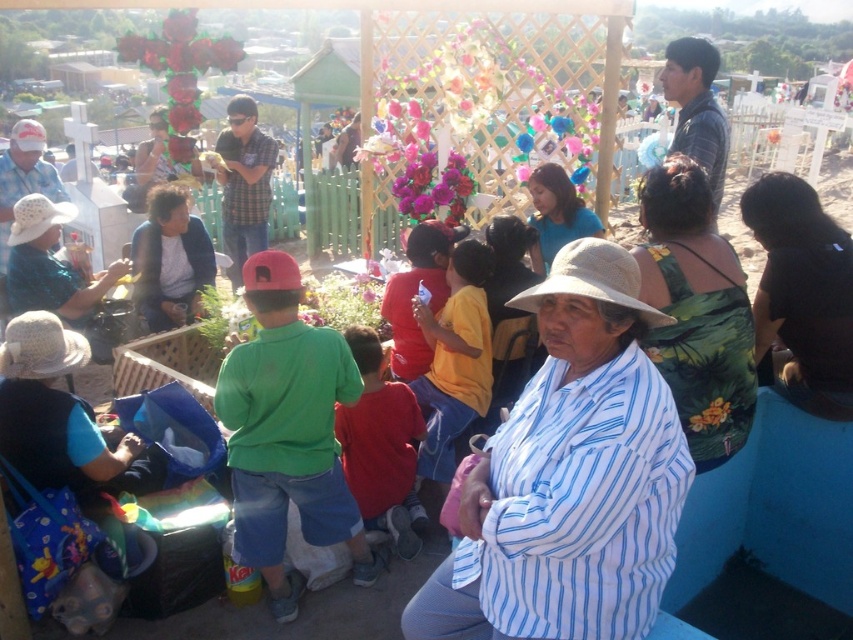
Looking at this image, you are a photographer trying to capture a photo of the red cotton shirt at center and the black fabric at lower right. Which object should you focus on first if you want to include both in your shot without moving the camera?

The black fabric at lower right is shorter than the red cotton shirt at center, so you should focus on the red cotton shirt at center first to ensure it is in frame before adjusting for the black fabric at lower right.

What are the coordinates of the white striped shirt at center?

The white striped shirt at center is located at coordinates point (570, 476).

You are a photographer at the event and want to take a photo of the blue fabric dress at center without the black fabric at lower right appearing in the frame. Is this possible based on their positions?

The black fabric at lower right is below the blue fabric dress at center, so if you position your camera to focus on the blue fabric dress at center and avoid looking downward, the black fabric at lower right should not appear in the frame.